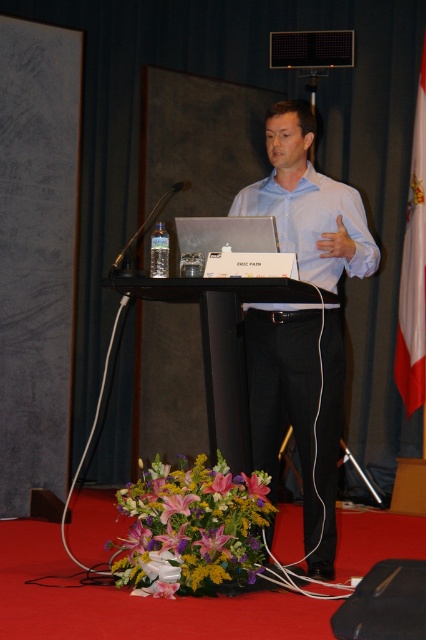
You are sitting in the audience and want to focus on two specific points on the podium. Which of the two points, point (250, 189) or point (414, 208), appears closer to you?

Point (250, 189) is closer to the viewer than point (414, 208), so it appears closer.

You are a photographer taking a photo of the podium. You notice two points on the podium labeled as point (313, 232) and point (241, 198). Which point will appear closer to the edge of the photo frame?

Point (313, 232) is closer to the camera than point (241, 198), so it will appear closer to the edge of the photo frame.

You are attending a presentation and notice two shirts on the podium. The white glossy shirt at center and the white smooth shirt at center. Which one is taller?

The white glossy shirt at center is taller than the white smooth shirt at center.